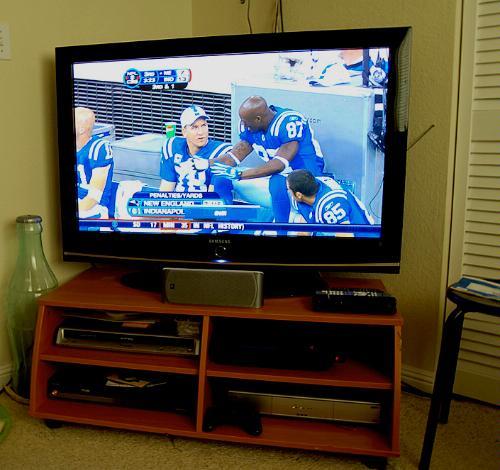
The width and height of the screenshot is (500, 470). What are the coordinates of `tv stand feet` in the screenshot? It's located at (51, 424), (376, 460).